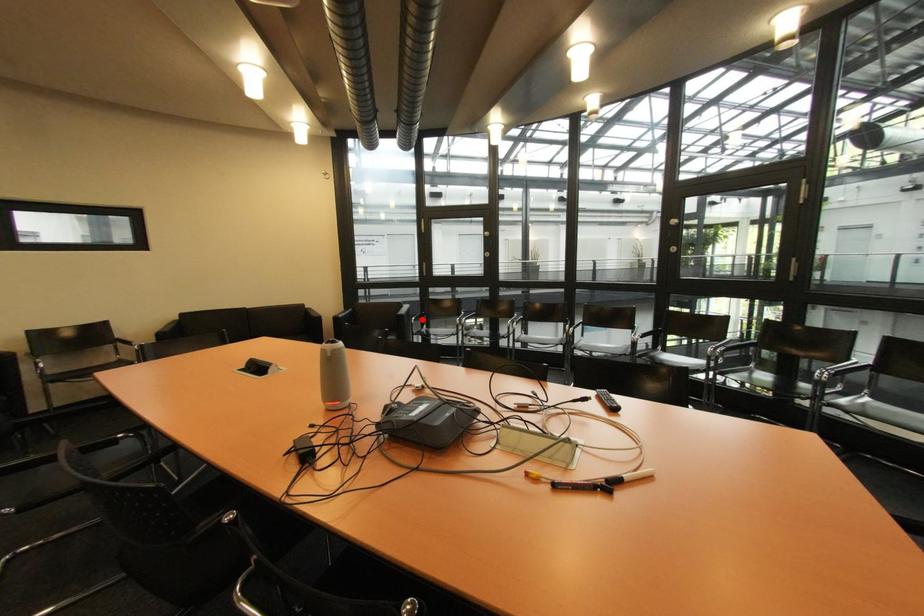
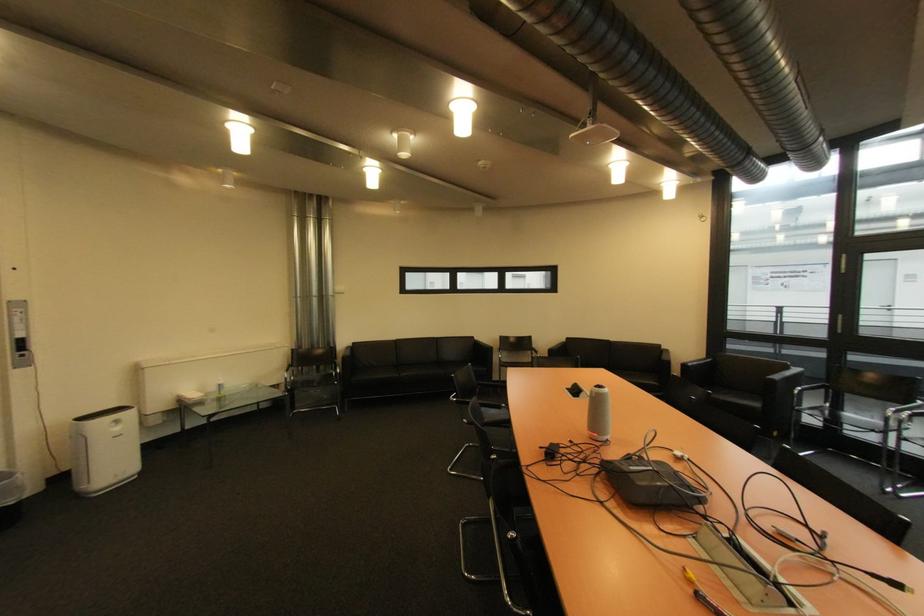
In the second image, find the point that corresponds to the highlighted location in the first image.

(808, 390)